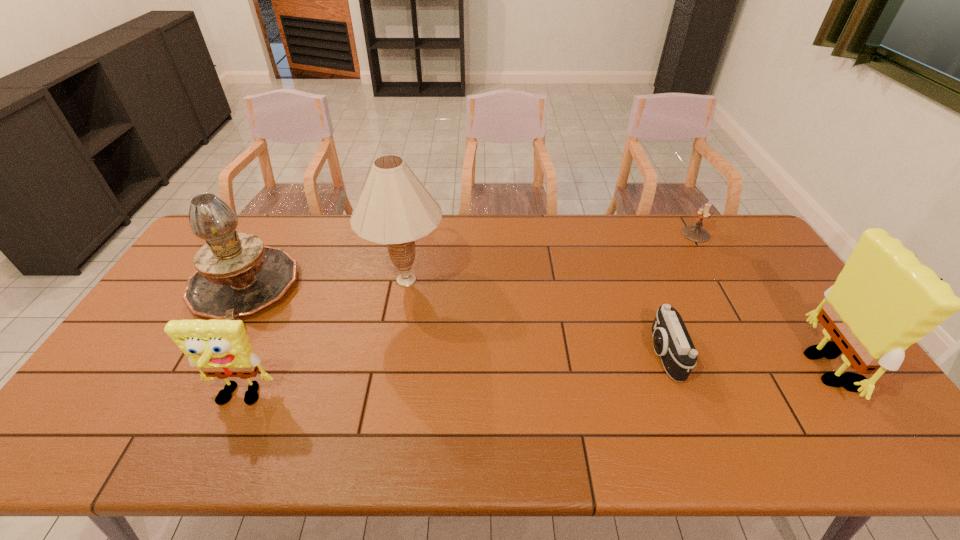
At what (x,y) coordinates should I click in order to perform the action: click on the shorter sponge. Please return your answer as a coordinate pair (x, y). Image resolution: width=960 pixels, height=540 pixels. Looking at the image, I should click on (218, 348).

Find the location of a particular element. the left sponge is located at coordinates click(218, 348).

Locate an element on the screen. the taller sponge is located at coordinates (884, 300).

Image resolution: width=960 pixels, height=540 pixels. Identify the location of the rightmost object. 884,300.

Locate an element on the screen. This screenshot has width=960, height=540. the fifth object from left to right is located at coordinates (694, 233).

You are a GUI agent. You are given a task and a screenshot of the screen. Output one action in this format:
    pyautogui.click(x=<x>, y=<y>)
    Task: Click on the candle holder
    This screenshot has width=960, height=540.
    Given the screenshot: What is the action you would take?
    pyautogui.click(x=694, y=233)

Locate an element on the screen. Image resolution: width=960 pixels, height=540 pixels. oil lamp is located at coordinates (237, 275).

This screenshot has width=960, height=540. What are the coordinates of `the third object from left to right` in the screenshot? It's located at click(394, 208).

Locate an element on the screen. The width and height of the screenshot is (960, 540). the shortest object is located at coordinates (671, 341).

I want to click on the fourth object from left to right, so click(x=671, y=341).